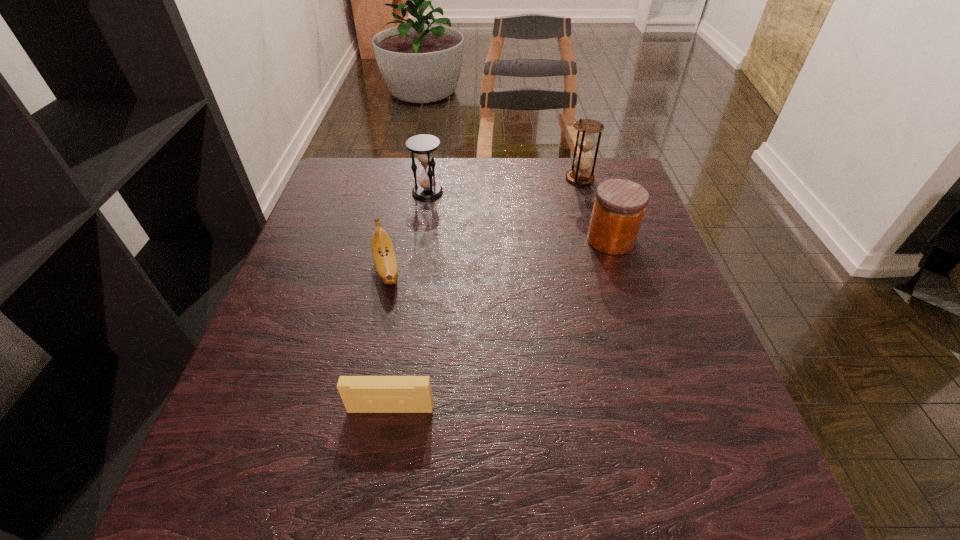
What are the coordinates of `the right hourglass` in the screenshot? It's located at (586, 141).

At what (x,y) coordinates should I click in order to perform the action: click on the left hourglass. Please return your answer as a coordinate pair (x, y). Looking at the image, I should click on (423, 145).

I want to click on jar, so (x=619, y=206).

This screenshot has height=540, width=960. What are the coordinates of `banana` in the screenshot? It's located at (383, 252).

Identify the location of the nearest object. The image size is (960, 540). (360, 394).

Identify the location of free space located 0.210m on the left of the right hourglass. This screenshot has height=540, width=960. (490, 178).

The width and height of the screenshot is (960, 540). What are the coordinates of `vacant point located on the right of the left hourglass` in the screenshot? It's located at (529, 192).

The width and height of the screenshot is (960, 540). I want to click on vacant space situated 0.250m on the back of the jar, so tap(588, 171).

Identify the location of free space located on the front of the banana. This screenshot has width=960, height=540. (376, 322).

The height and width of the screenshot is (540, 960). In order to click on vacant space located at the front of the nearest object with spools in this screenshot , I will do `click(378, 484)`.